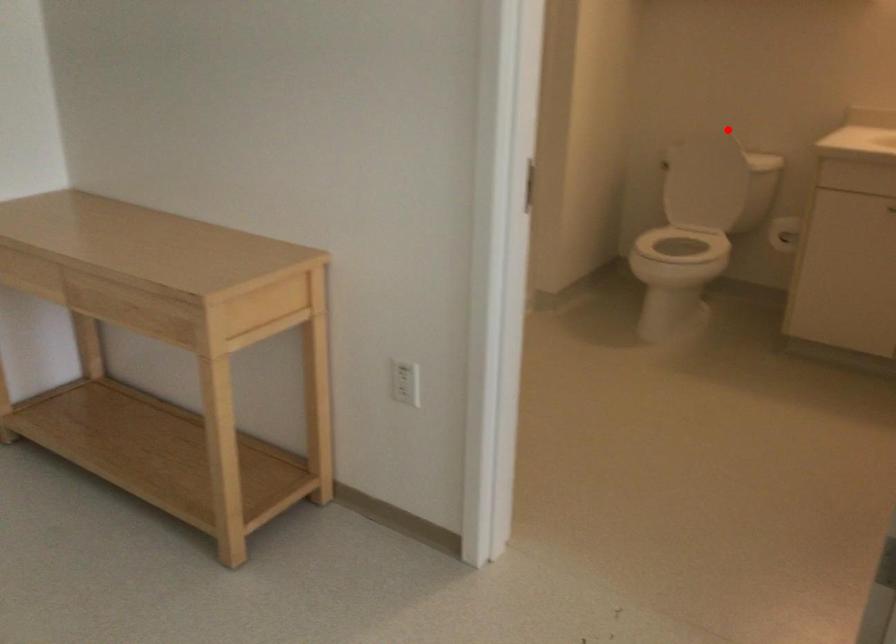
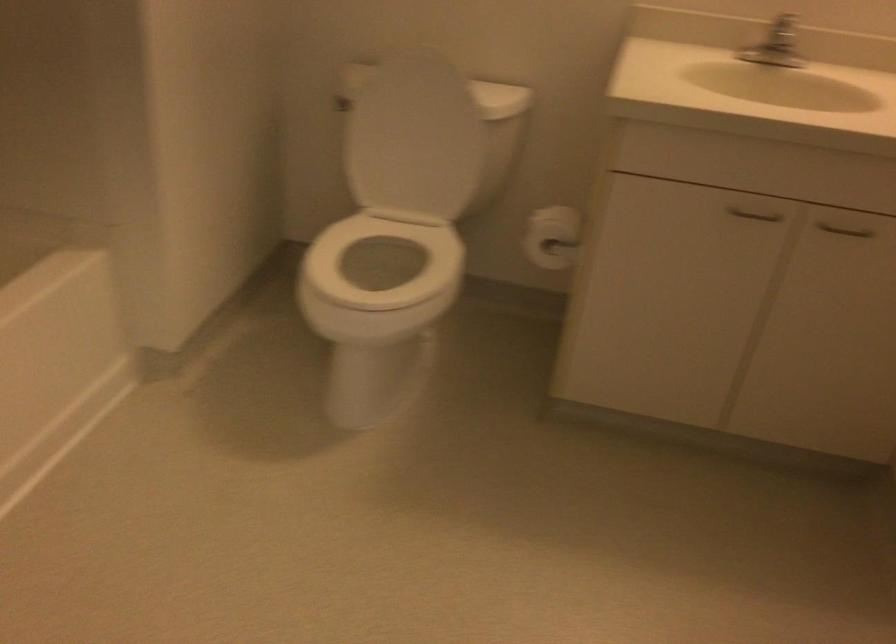
In the second image, find the point that corresponds to the highlighted location in the first image.

(440, 61)